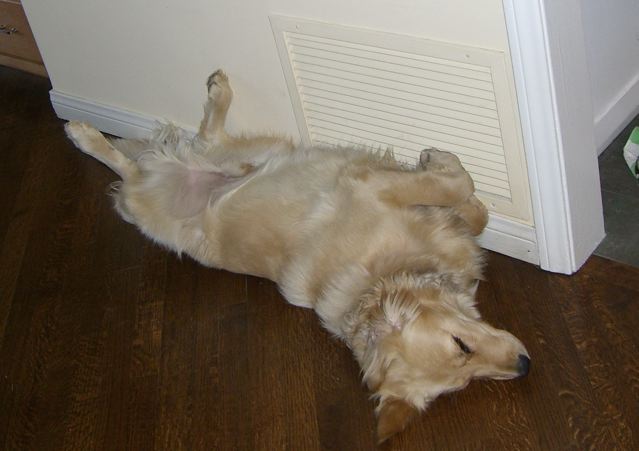
Where is `floor`? This screenshot has height=451, width=639. floor is located at coordinates (284, 384).